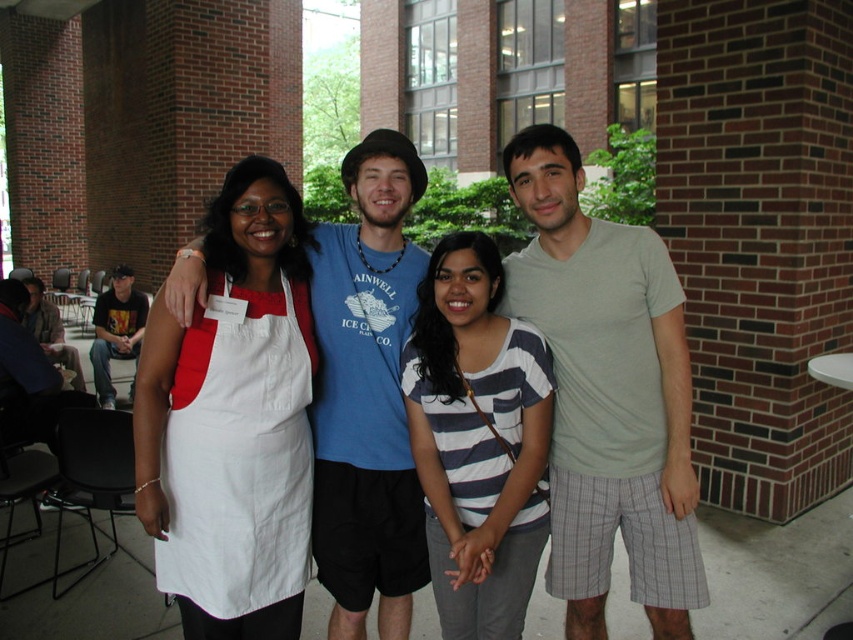
Does blue cotton t-shirt at center lie behind dark gray t-shirt at left?

No, it is in front of dark gray t-shirt at left.

From the picture: Does blue cotton t-shirt at center have a smaller size compared to dark gray t-shirt at left?

Yes.

Is point (321, 339) closer to viewer compared to point (106, 300)?

Yes, it is in front of point (106, 300).

The height and width of the screenshot is (640, 853). I want to click on blue cotton t-shirt at center, so click(x=367, y=394).

Consider the image. Does light gray cotton t-shirt at center appear on the right side of dark gray t-shirt at left?

Yes, light gray cotton t-shirt at center is to the right of dark gray t-shirt at left.

Locate an element on the screen. This screenshot has width=853, height=640. light gray cotton t-shirt at center is located at coordinates (607, 394).

Does white apron at center appear on the left side of blue cotton t-shirt at center?

In fact, white apron at center is to the right of blue cotton t-shirt at center.

Who is positioned more to the right, white apron at center or blue cotton t-shirt at center?

Positioned to the right is white apron at center.

The height and width of the screenshot is (640, 853). I want to click on white apron at center, so click(608, 392).